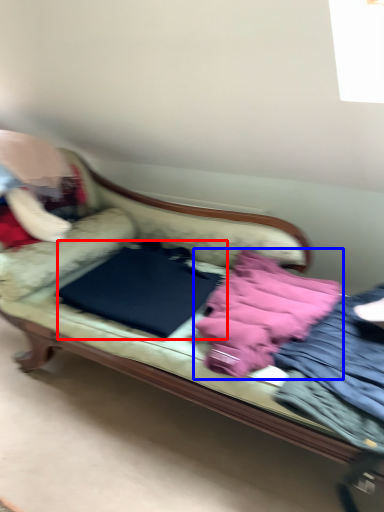
Question: Among these objects, which one is nearest to the camera, sheet (highlighted by a red box) or material (highlighted by a blue box)?

Choices:
 (A) sheet
 (B) material

Answer: (B)